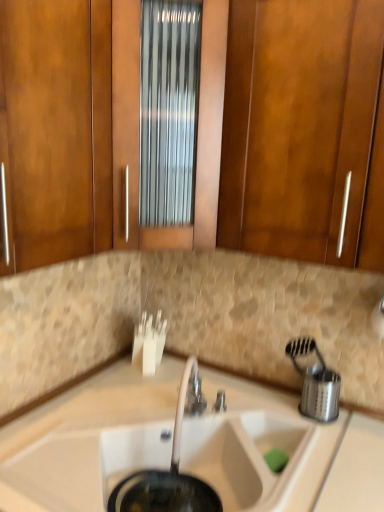
Question: Is white matte sink at center to the left of matte wood cabinet at upper center, placed as the 2th cabinetry when sorted from right to left, from the viewer's perspective?

Choices:
 (A) no
 (B) yes

Answer: (A)

Question: Is white matte sink at center placed right next to matte wood cabinet at upper center, which appears as the 1th cabinetry when viewed from the left?

Choices:
 (A) yes
 (B) no

Answer: (B)

Question: Is the depth of white matte sink at center less than that of matte wood cabinet at upper center, placed as the 2th cabinetry when sorted from right to left?

Choices:
 (A) no
 (B) yes

Answer: (A)

Question: Is white matte sink at center aimed at matte wood cabinet at upper center, placed as the 2th cabinetry when sorted from right to left?

Choices:
 (A) no
 (B) yes

Answer: (A)

Question: Considering the relative sizes of white matte sink at center and matte wood cabinet at upper center, which appears as the 1th cabinetry when viewed from the left, in the image provided, is white matte sink at center thinner than matte wood cabinet at upper center, which appears as the 1th cabinetry when viewed from the left,?

Choices:
 (A) no
 (B) yes

Answer: (A)

Question: Considering the positions of point (200, 391) and point (34, 57), is point (200, 391) closer or farther from the camera than point (34, 57)?

Choices:
 (A) closer
 (B) farther

Answer: (B)

Question: Relative to matte wood cabinet at upper center, placed as the 2th cabinetry when sorted from right to left, is white ceramic faucet at center in front or behind?

Choices:
 (A) behind
 (B) front

Answer: (A)

Question: From the image's perspective, relative to matte wood cabinet at upper center, placed as the 2th cabinetry when sorted from right to left, is white ceramic faucet at center above or below?

Choices:
 (A) below
 (B) above

Answer: (A)

Question: In terms of width, does white ceramic faucet at center look wider or thinner when compared to matte wood cabinet at upper center, placed as the 2th cabinetry when sorted from right to left?

Choices:
 (A) wide
 (B) thin

Answer: (B)

Question: Is wooden cabinet at center, marked as the 1th cabinetry in a right-to-left arrangement, inside the boundaries of white ceramic faucet at center, or outside?

Choices:
 (A) inside
 (B) outside

Answer: (B)

Question: Is point (238, 106) closer or farther from the camera than point (195, 369)?

Choices:
 (A) farther
 (B) closer

Answer: (B)

Question: Based on their sizes in the image, would you say wooden cabinet at center, marked as the 1th cabinetry in a right-to-left arrangement, is bigger or smaller than white ceramic faucet at center?

Choices:
 (A) small
 (B) big

Answer: (B)

Question: From a real-world perspective, relative to white ceramic faucet at center, is wooden cabinet at center, the second cabinetry in the left-to-right sequence, vertically above or below?

Choices:
 (A) above
 (B) below

Answer: (A)

Question: Is point (39, 391) positioned closer to the camera than point (213, 403)?

Choices:
 (A) farther
 (B) closer

Answer: (B)

Question: Based on their sizes in the image, would you say white matte sink at center is bigger or smaller than silver metallic faucet at center?

Choices:
 (A) small
 (B) big

Answer: (B)